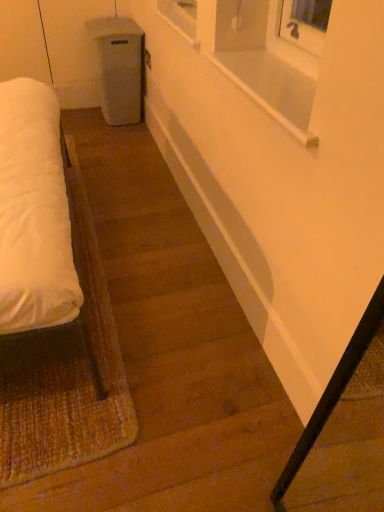
What do you see at coordinates (119, 68) in the screenshot? I see `white plastic trash bin at center` at bounding box center [119, 68].

The width and height of the screenshot is (384, 512). Find the location of `white plastic trash bin at center`. white plastic trash bin at center is located at coordinates (119, 68).

Measure the distance between point (92, 40) and camera.

They are 2.76 meters apart.

Image resolution: width=384 pixels, height=512 pixels. In order to click on white plastic trash bin at center in this screenshot , I will do `click(119, 68)`.